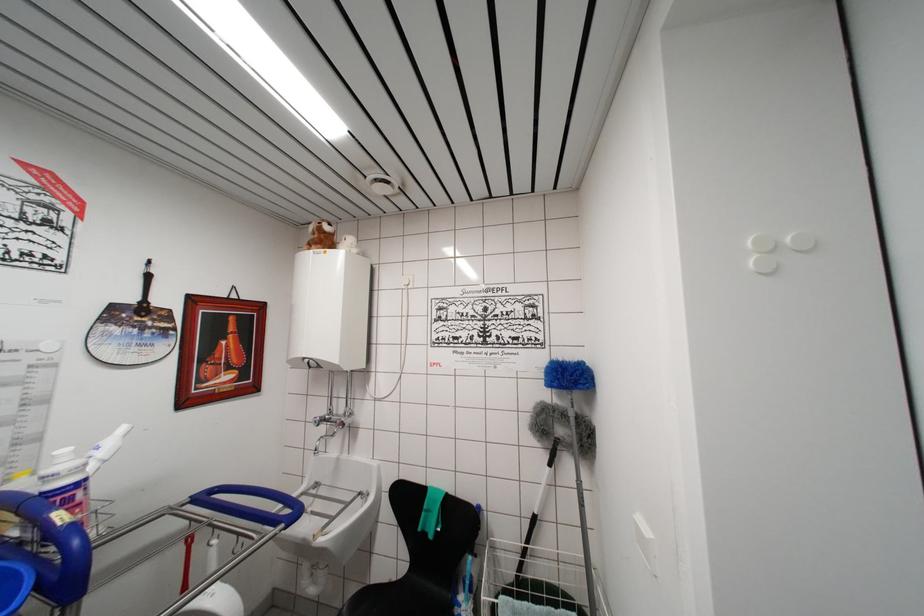
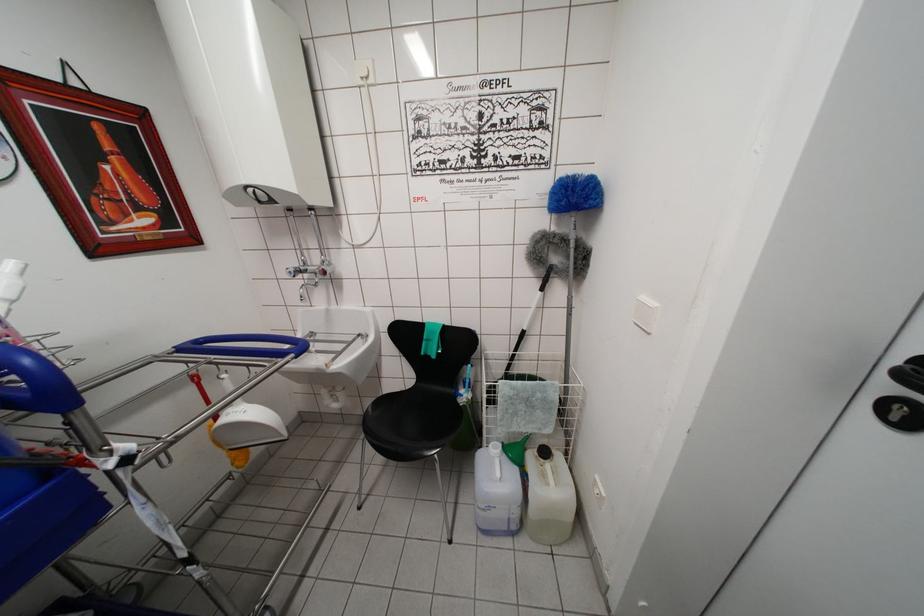
In a continuous first-person perspective shot, in which direction is the camera moving?

The movement direction of the cameraman is left, forward.